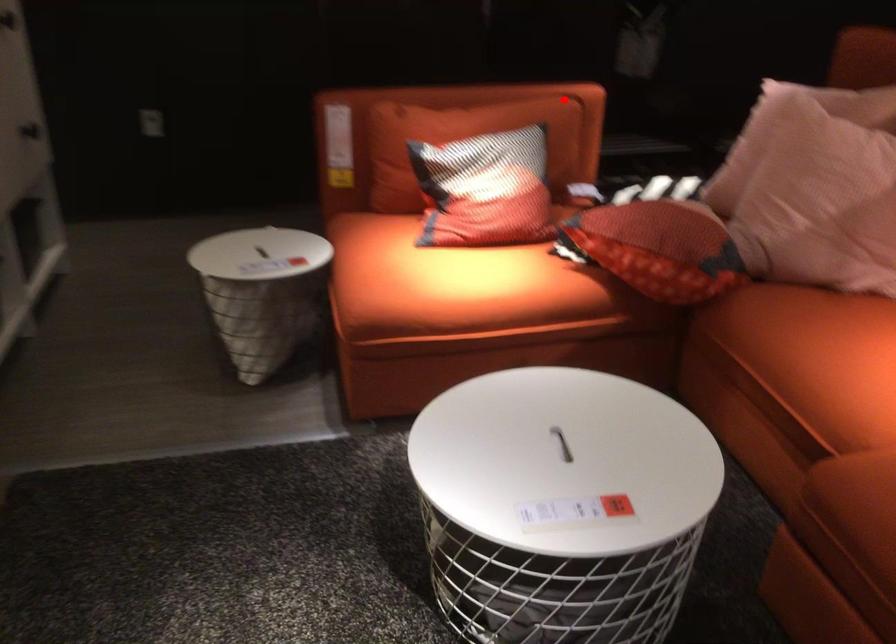
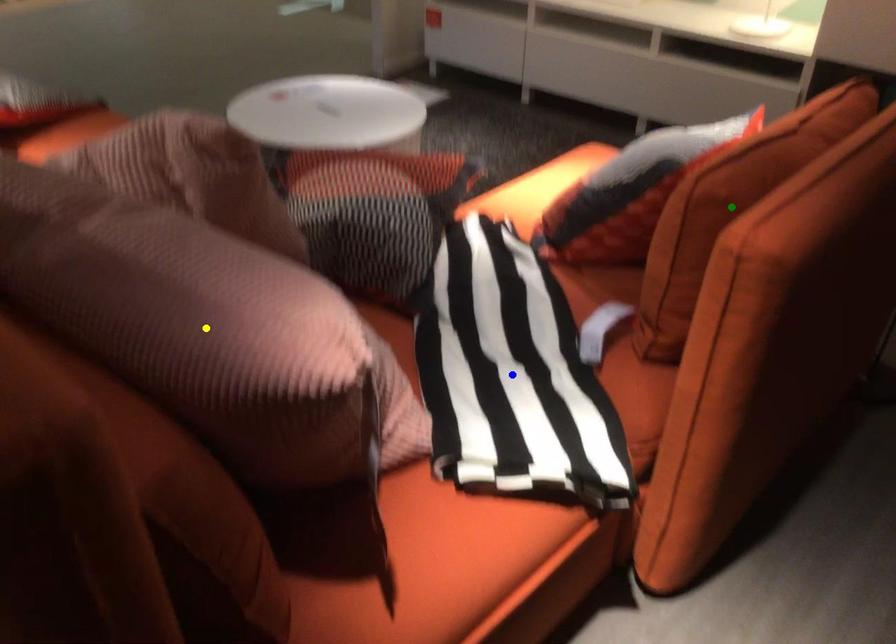
Question: I am providing you with two images of the same scene from different viewpoints. A red point is marked on the first image. You are given multiple points on the second image. Which point in image 2 represents the same 3d spot as the red point in image 1?

Choices:
 (A) green point
 (B) yellow point
 (C) blue point

Answer: (A)